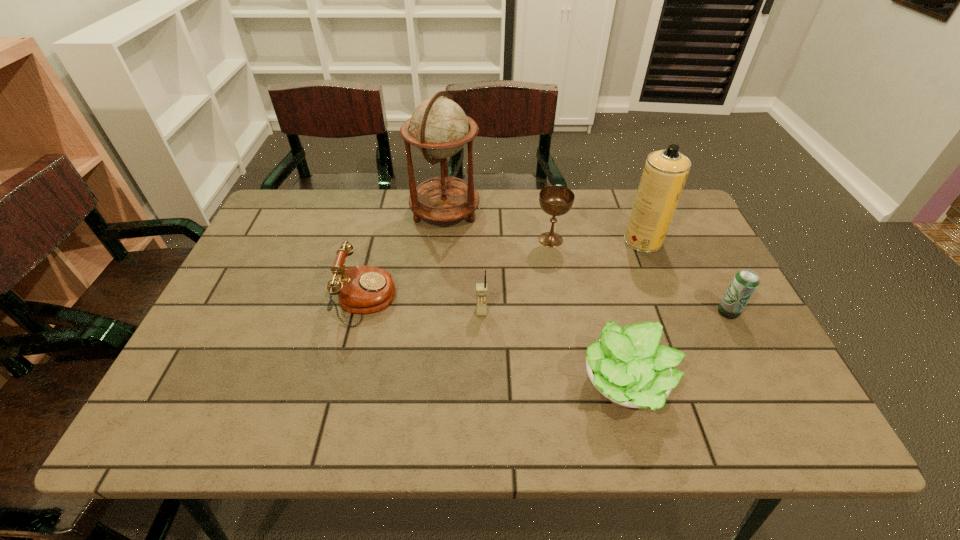
Choose which object is the second nearest neighbor to the sixth object from left to right. Please provide its 2D coordinates. Your answer should be formatted as a tuple, i.e. [(x, y)], where the tuple contains the x and y coordinates of a point satisfying the conditions above.

[(745, 282)]

Locate an element on the screen. Image resolution: width=960 pixels, height=540 pixels. vacant region that satisfies the following two spatial constraints: 1. on the front side of the chalice; 2. on the right side of the shortest object is located at coordinates (576, 387).

Where is `vacant space that satisfies the following two spatial constraints: 1. on the back side of the lettuce; 2. on the surface of the tallest object`? This screenshot has width=960, height=540. vacant space that satisfies the following two spatial constraints: 1. on the back side of the lettuce; 2. on the surface of the tallest object is located at coordinates (580, 212).

The height and width of the screenshot is (540, 960). In order to click on free spot that satisfies the following two spatial constraints: 1. on the surface of the chalice; 2. on the left side of the tallest object in this screenshot , I will do `click(443, 240)`.

Identify the location of vacant space that satisfies the following two spatial constraints: 1. on the dial of the telephone; 2. on the right side of the nearest object. The width and height of the screenshot is (960, 540). (345, 387).

The height and width of the screenshot is (540, 960). What are the coordinates of `free location that satisfies the following two spatial constraints: 1. on the front of the cellular telephone, where the keypad is located; 2. on the left side of the rightmost object` in the screenshot? It's located at (482, 312).

Locate an element on the screen. This screenshot has width=960, height=540. vacant space that satisfies the following two spatial constraints: 1. on the surface of the tallest object; 2. on the back side of the shortest object is located at coordinates (429, 387).

I want to click on free space in the image that satisfies the following two spatial constraints: 1. on the front of the cellular telephone, where the keypad is located; 2. on the left side of the lettuce, so point(482,387).

You are a GUI agent. You are given a task and a screenshot of the screen. Output one action in this format:
    pyautogui.click(x=<x>, y=<y>)
    Task: Click on the vacant region that satisfies the following two spatial constraints: 1. on the front of the cellular telephone, where the keypad is located; 2. on the left side of the nearest object
    This screenshot has height=540, width=960.
    Given the screenshot: What is the action you would take?
    pyautogui.click(x=482, y=387)